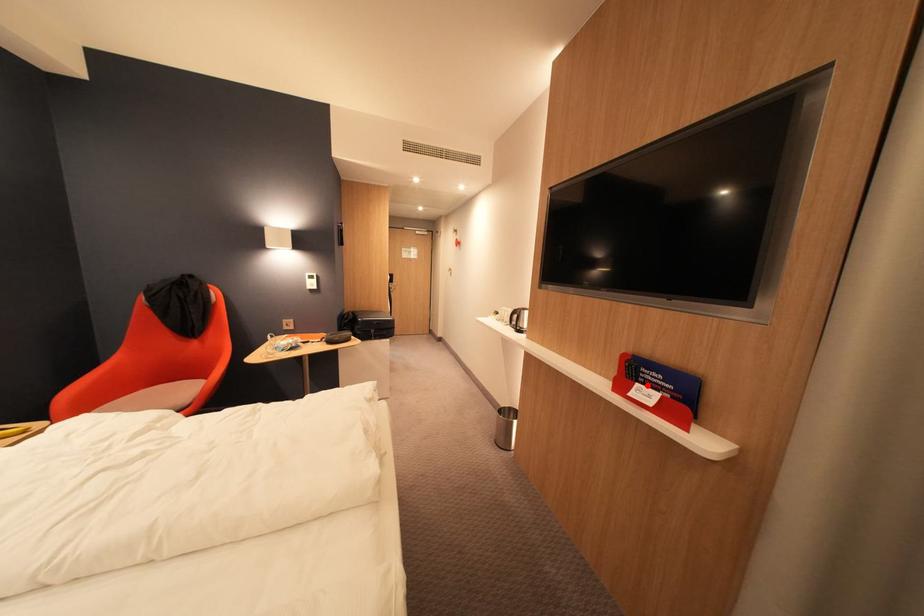
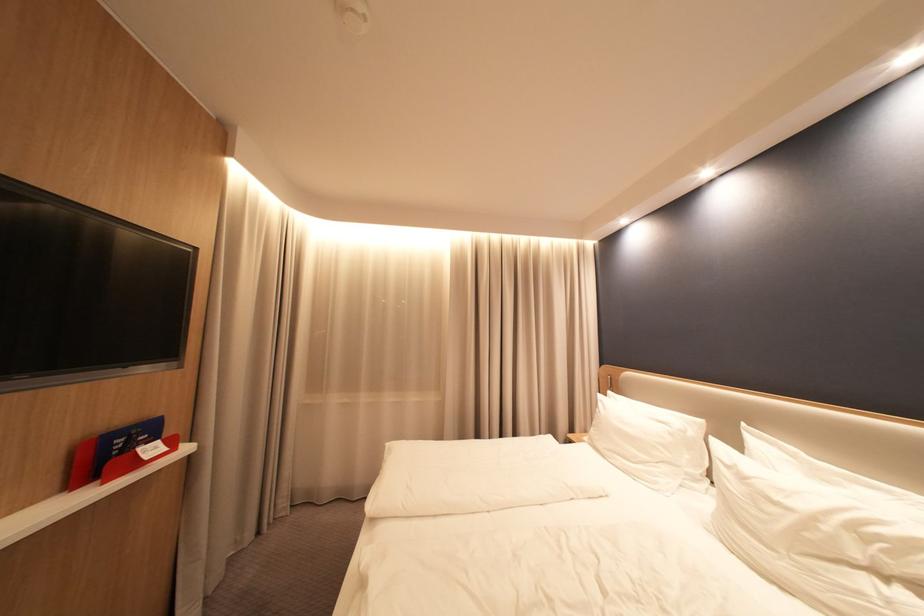
Find the pixel in the second image that matches the highlighted location in the first image.

(150, 452)